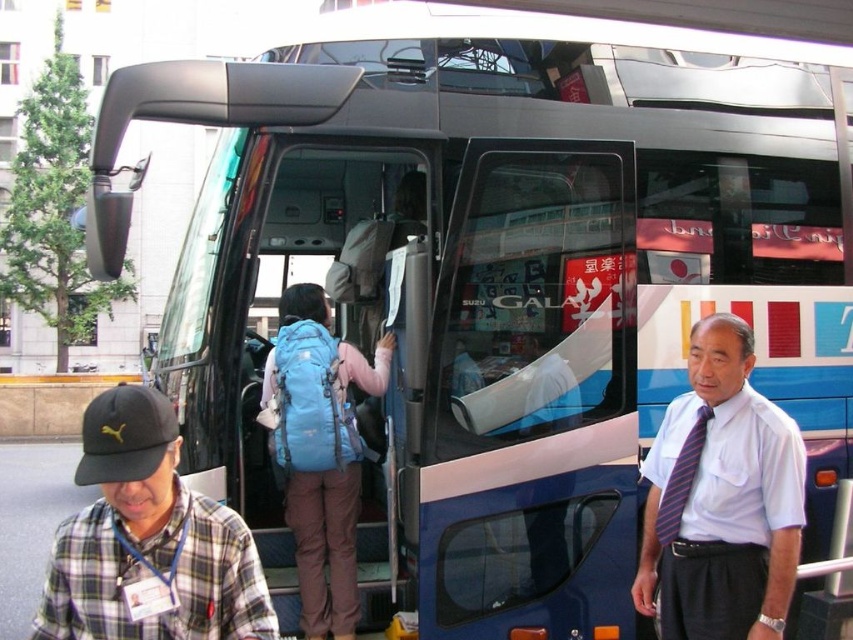
You are a photographer at the bus stop and want to take a picture of both the white shirt with tie at center and the plaid shirt at lower left in the same frame. Which person should be positioned to the left in the photo?

The plaid shirt at lower left should be positioned to the left in the photo because the white shirt with tie at center is to the right of it.

You are a photographer trying to capture a clear shot of both the blue fabric backpack at center and the striped fabric tie at right. Since you want both items in focus, which one should you adjust your camera focus to prioritize first?

You should prioritize focusing on the blue fabric backpack at center first because it is closer to the viewer than the striped fabric tie at right, ensuring both can be in focus by using a smaller aperture or adjusting the focal plane accordingly.

You are standing at the bus stop and see the blue fabric backpack at center. Where exactly is it located in terms of coordinates?

The blue fabric backpack at center is located at coordinates point (x=325, y=547).